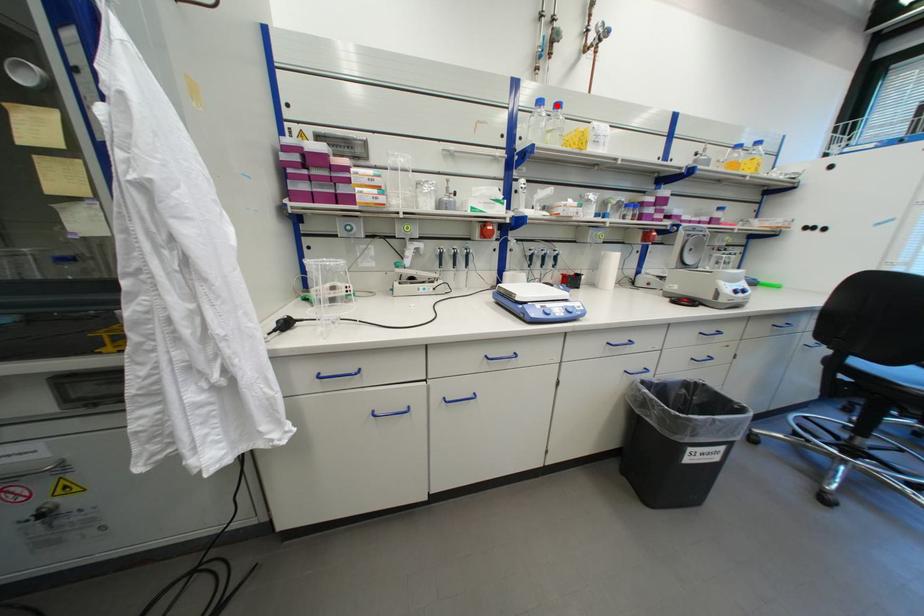
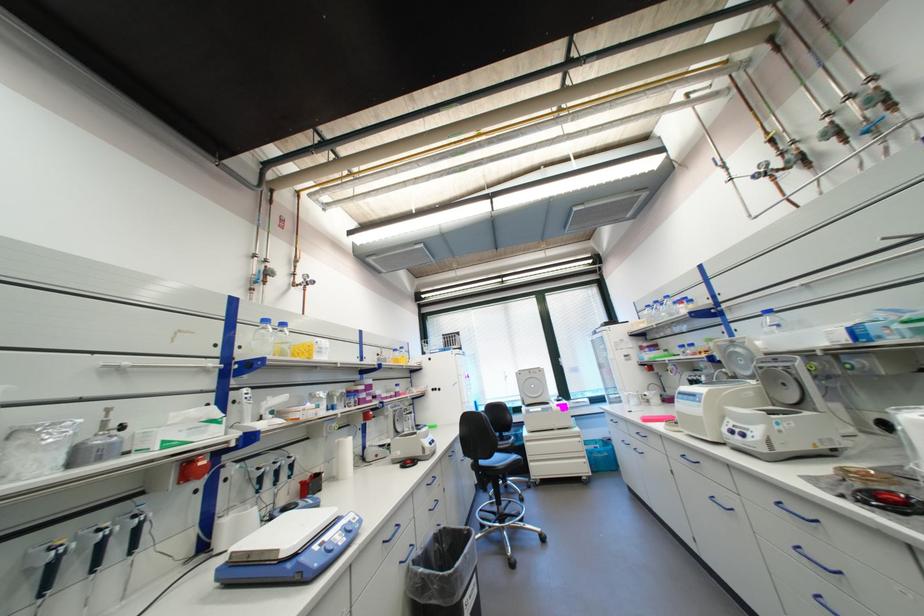
Question: I am providing you with two images of the same scene from different viewpoints. A red point is shown in image1. For the corresponding object point in image2, is it positioned nearer or farther from the camera?

Choices:
 (A) Nearer
 (B) Farther

Answer: (B)